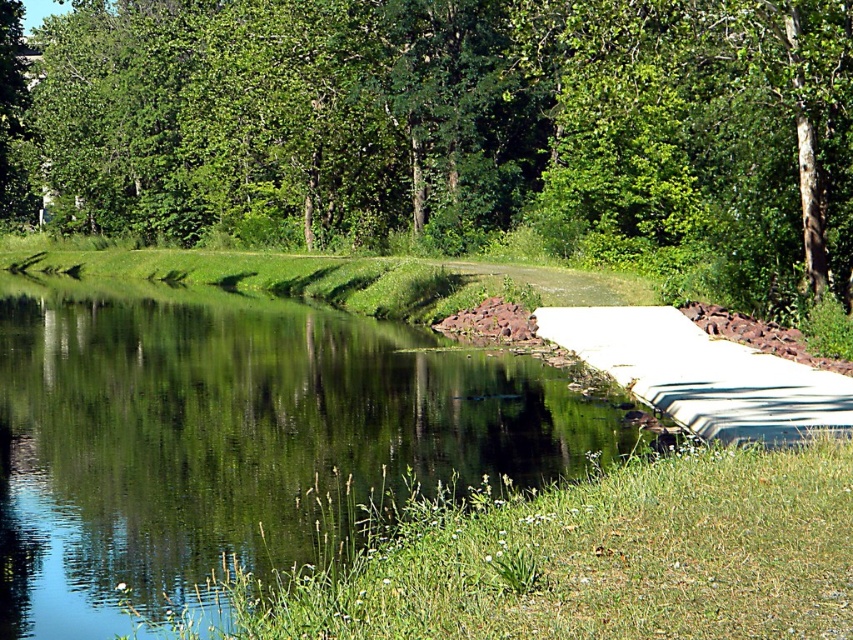
You are standing on the grassy area with small white flowers and want to walk to the clear water at center. Which direction should you walk to avoid the green leafy tree at upper center?

To reach the clear water at center while avoiding the green leafy tree at upper center, you should walk to the right side of the green leafy tree at upper center since it is positioned on the left side of the clear water at center.

From the picture: You are standing on the grassy bank and looking at the green leafy tree at upper center and the clear water at center. Which object is higher in the image?

The green leafy tree at upper center is higher than the clear water at center in the image.

You are standing in the serene natural scene described. You want to take a photo of the green leafy tree at upper center. Which object in the scene is located at the coordinates point (461, 125) where the tree is represented?

The green leafy tree at upper center is represented by the point (461, 125).